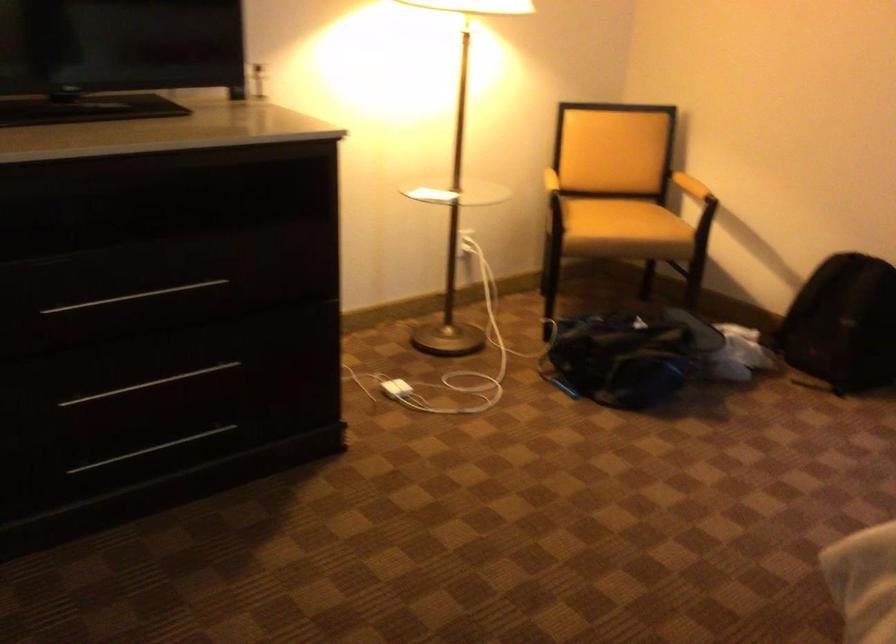
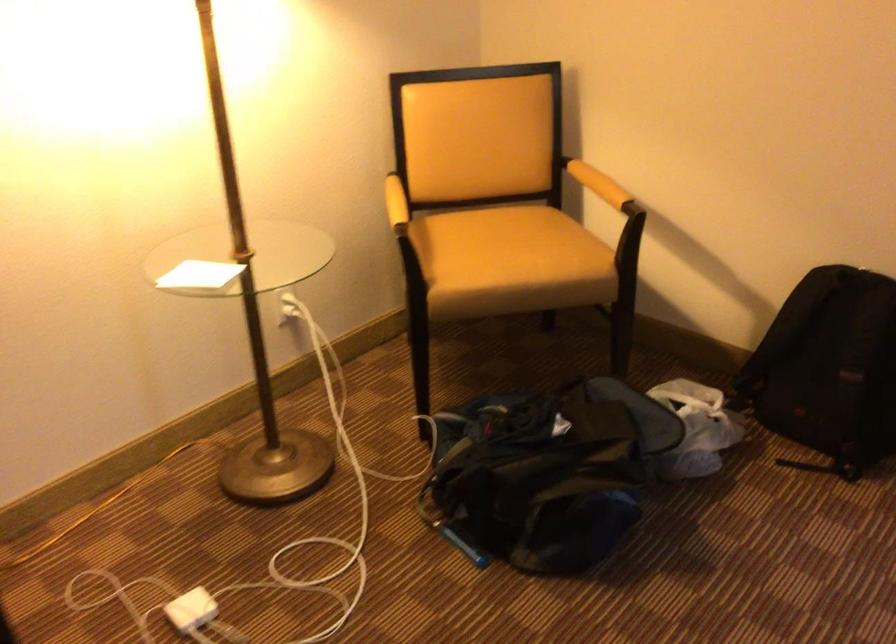
The point at (615,220) is marked in the first image. Where is the corresponding point in the second image?

(510, 261)